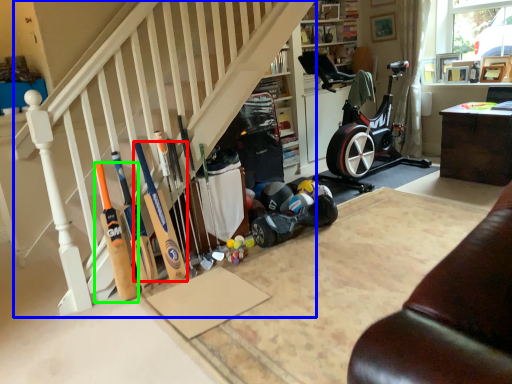
Question: Based on their relative distances, which object is nearer to baseball bat (highlighted by a red box)? Choose from stairwell (highlighted by a blue box) and baseball bat (highlighted by a green box).

Choices:
 (A) stairwell
 (B) baseball bat

Answer: (B)